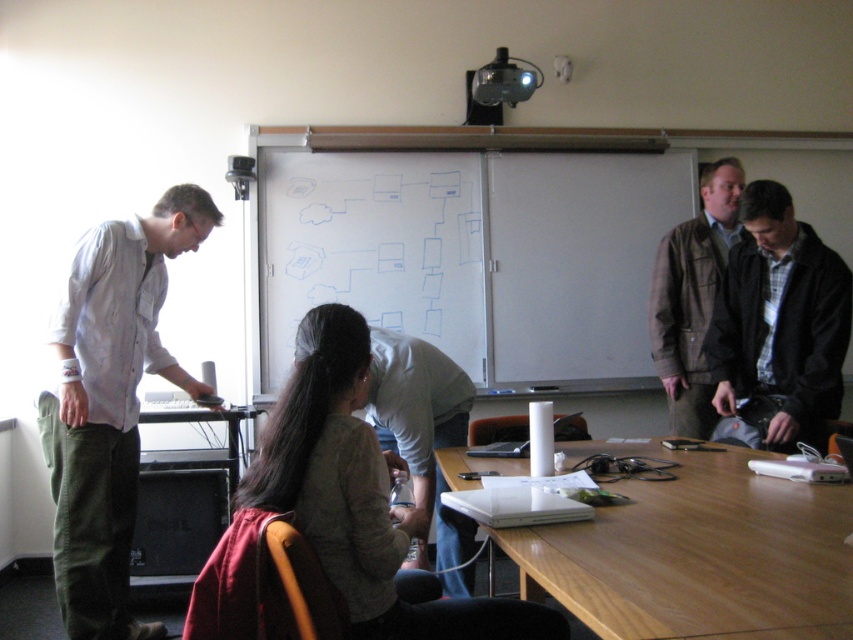
Question: Does light brown fabric jacket at center have a larger size compared to black plastic projector at upper center?

Choices:
 (A) yes
 (B) no

Answer: (A)

Question: Is brown woolen jacket at upper right positioned in front of black plastic projector at upper center?

Choices:
 (A) no
 (B) yes

Answer: (B)

Question: Estimate the real-world distances between objects in this image. Which object is farther from the white matte board at center?

Choices:
 (A) dark brown leather jacket at right
 (B) wooden table at lower right
 (C) black plastic projector at upper center

Answer: (B)

Question: Can you confirm if white matte board at center is positioned to the left of black plastic projector at upper center?

Choices:
 (A) yes
 (B) no

Answer: (A)

Question: Which object is positioned closest to the black plastic projector at upper center?

Choices:
 (A) brown woolen jacket at upper right
 (B) wooden table at lower right
 (C) dark brown leather jacket at right

Answer: (A)

Question: Which point is farther to the camera?

Choices:
 (A) light gray shirt at left
 (B) wooden table at lower right
 (C) white matte board at center
 (D) brown woolen jacket at upper right

Answer: (C)